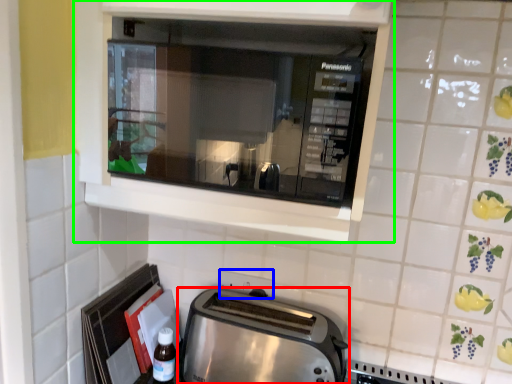
Question: Based on their relative distances, which object is farther from toaster (highlighted by a red box)? Choose from electric outlet (highlighted by a blue box) and cabinetry (highlighted by a green box).

Choices:
 (A) electric outlet
 (B) cabinetry

Answer: (B)